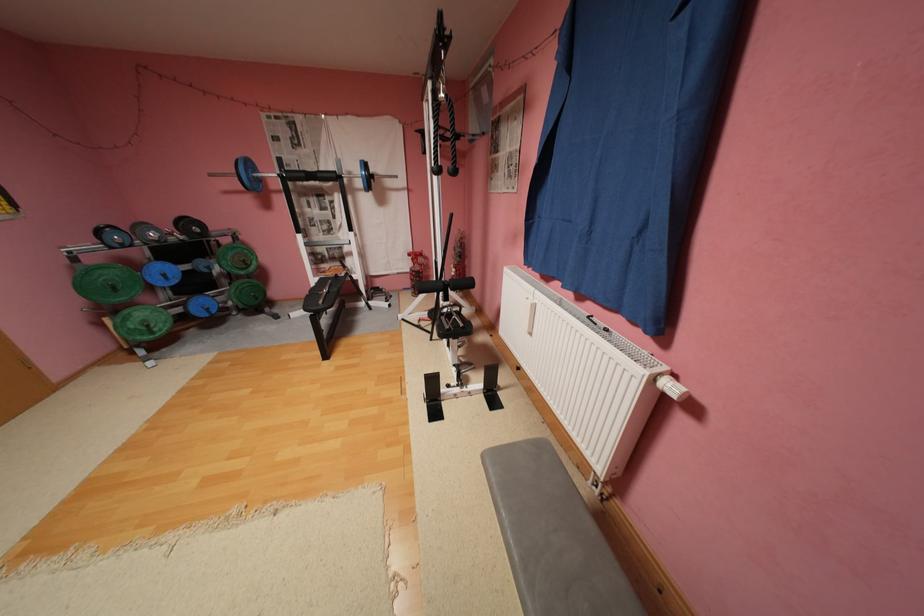
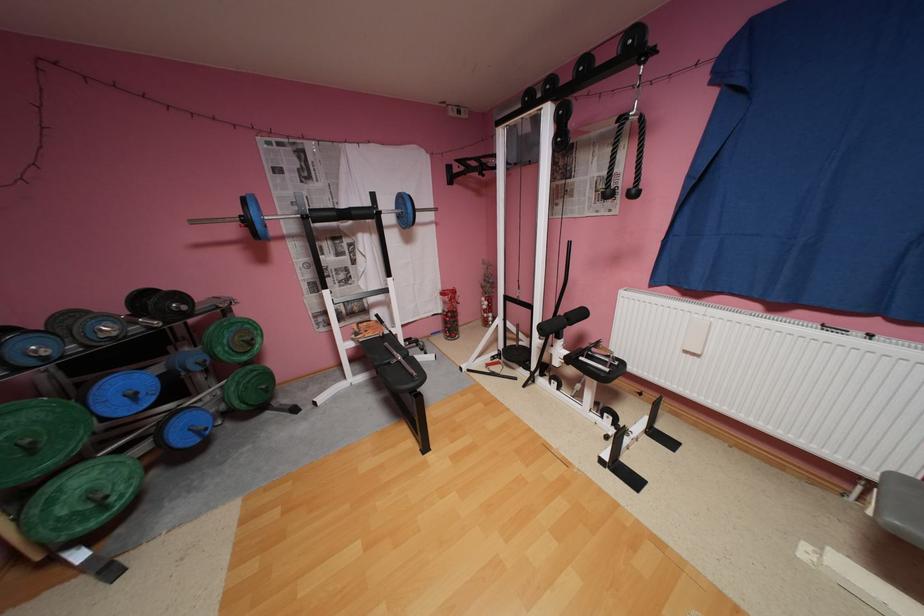
In the second image, find the point that corresponds to the point at 220,175 in the first image.

(202, 223)